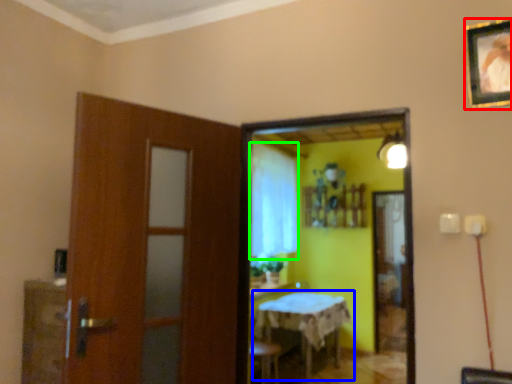
Question: Which is farther away from picture frame (highlighted by a red box)? table (highlighted by a blue box) or curtain (highlighted by a green box)?

Choices:
 (A) table
 (B) curtain

Answer: (B)